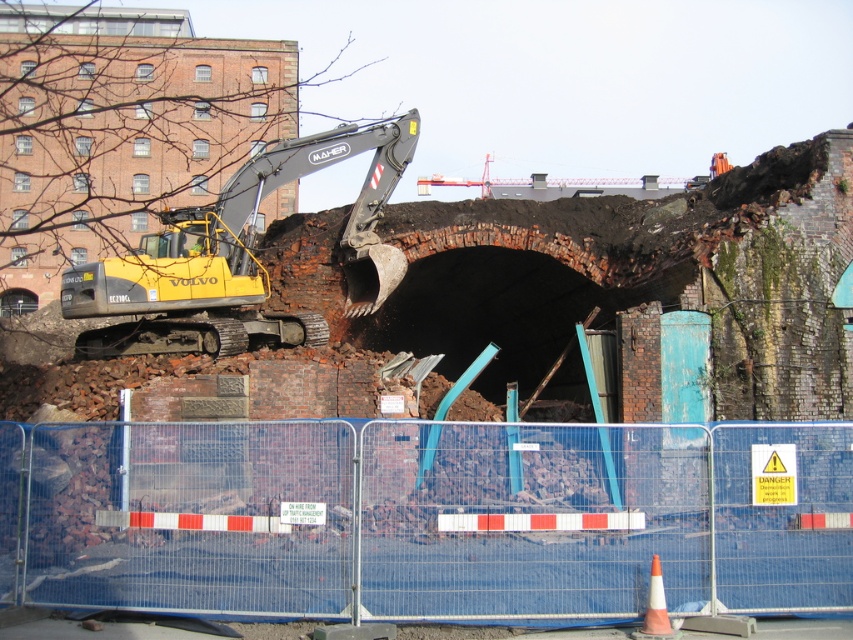
You are a safety inspector standing at the camera position. You need to ensure that the blue mesh fence at center is at least 40 feet away from the active demolition area to comply with safety regulations. Based on the information provided, does the current distance meet the requirement?

The blue mesh fence at center is 39.74 feet from camera, which is less than the required 40 feet. Therefore, the current distance does not meet the safety requirement.

Looking at this image, you are a construction worker standing at the entrance of the site. You need to locate the blue mesh fence at center. According to the coordinates provided, where should you look to find it?

The blue mesh fence at center is located at the coordinates point (426, 516).

You are a safety inspector at the construction site. You need to ensure that the blue mesh fence at center is visible to workers operating the yellow rubber excavator at left. Based on their positions, can the excavator operator see the fence clearly?

The blue mesh fence at center is in front of the yellow rubber excavator at left, so the operator would have a clear view of the fence as it is positioned directly ahead.